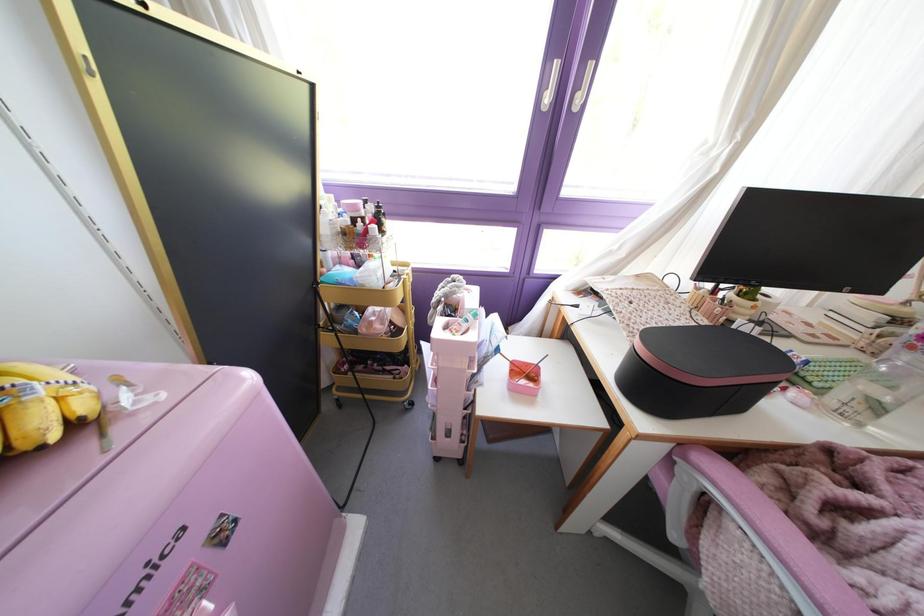
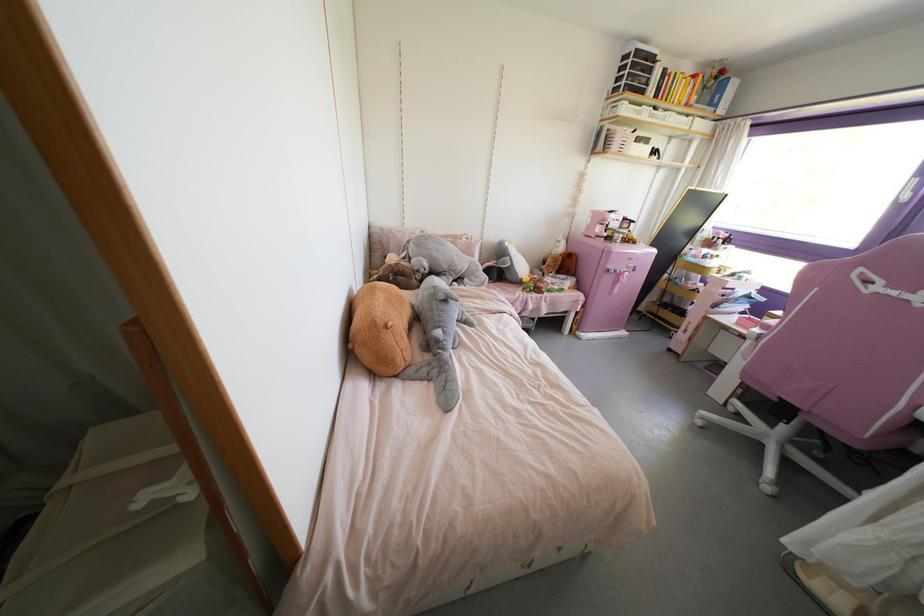
Locate, in the second image, the point that corresponds to (224,541) in the first image.

(633, 270)